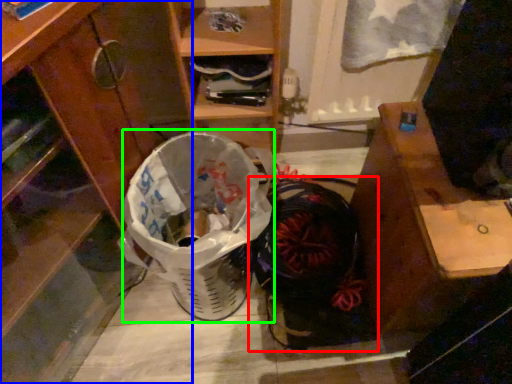
Question: Which object is the closest to the footwear (highlighted by a red box)? Choose among these: cabinetry (highlighted by a blue box) or shopping basket (highlighted by a green box).

Choices:
 (A) cabinetry
 (B) shopping basket

Answer: (B)